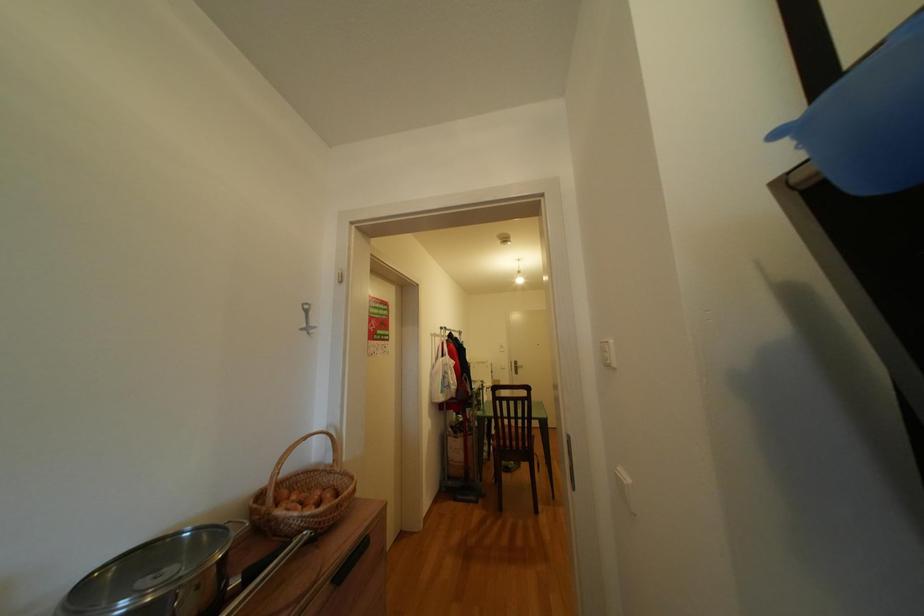
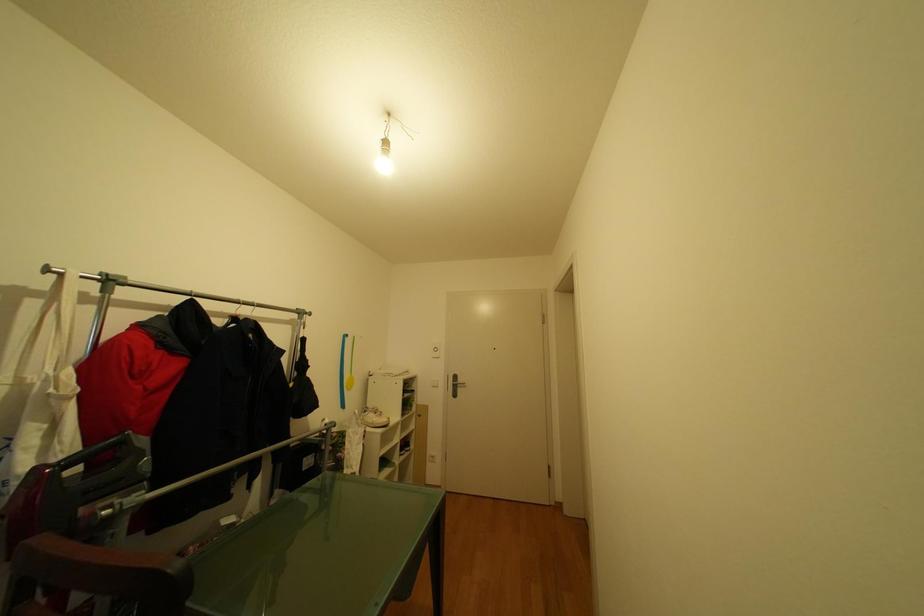
What movement of the cameraman would produce the second image?

The cameraman walked toward right, forward.